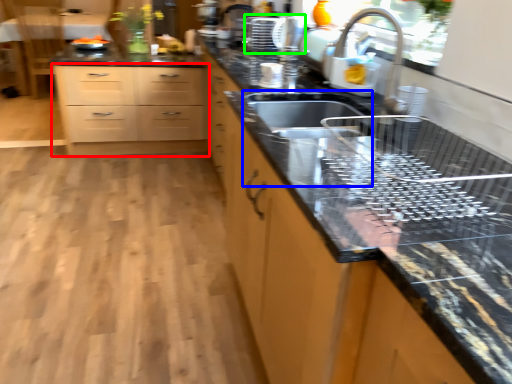
Question: Estimate the real-world distances between objects in this image. Which object is farther from chest of drawers (highlighted by a red box), sink (highlighted by a blue box) or appliance (highlighted by a green box)?

Choices:
 (A) sink
 (B) appliance

Answer: (A)